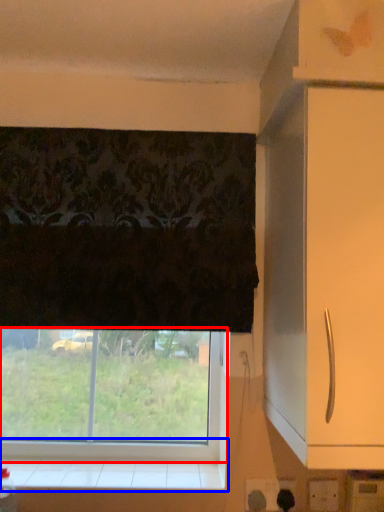
Question: Among these objects, which one is farthest to the camera, window (highlighted by a red box) or window sill (highlighted by a blue box)?

Choices:
 (A) window
 (B) window sill

Answer: (A)